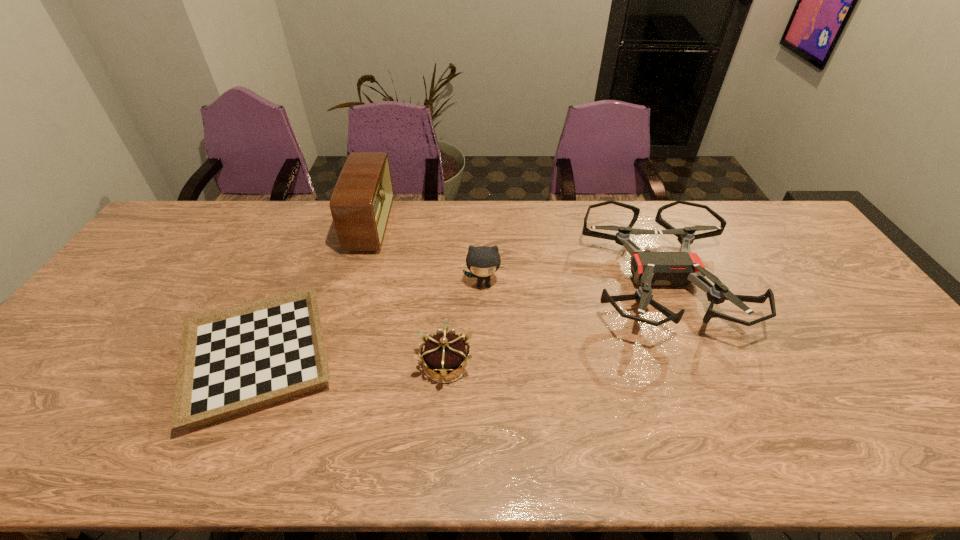
You are a GUI agent. You are given a task and a screenshot of the screen. Output one action in this format:
    pyautogui.click(x=<x>, y=<y>)
    Task: Click on the tallest object
    The height and width of the screenshot is (540, 960).
    Given the screenshot: What is the action you would take?
    click(x=361, y=202)

The height and width of the screenshot is (540, 960). What are the coordinates of `the fourth shortest object` in the screenshot? It's located at (483, 261).

This screenshot has height=540, width=960. Find the location of `the rightmost object`. the rightmost object is located at coordinates (677, 269).

Find the location of a particular element. This screenshot has width=960, height=540. crown is located at coordinates (443, 353).

You are a GUI agent. You are given a task and a screenshot of the screen. Output one action in this format:
    pyautogui.click(x=<x>, y=<y>)
    Task: Click on the shortest object
    This screenshot has height=540, width=960.
    Given the screenshot: What is the action you would take?
    pyautogui.click(x=234, y=360)

What are the coordinates of `vacant space located on the front-facing side of the tallest object` in the screenshot? It's located at (409, 227).

Locate an element on the screen. Image resolution: width=960 pixels, height=540 pixels. free region located 0.160m on the front-facing side of the kitten is located at coordinates (484, 338).

At what (x,y) coordinates should I click in order to perform the action: click on vacant space located with the camera facing forward on the drone. Please return your answer as a coordinate pair (x, y). Looking at the image, I should click on (701, 379).

The width and height of the screenshot is (960, 540). Identify the location of vacant space located on the left of the crown. (351, 364).

This screenshot has width=960, height=540. In order to click on free space located on the left of the checkerboard in this screenshot , I will do `click(60, 358)`.